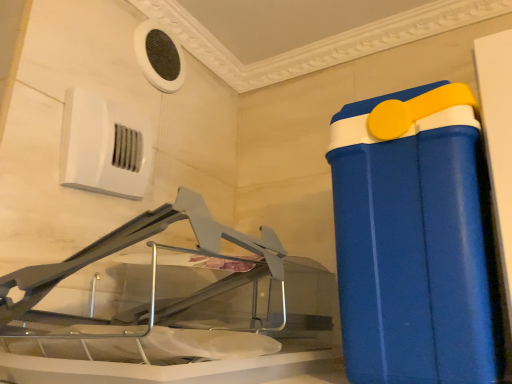
The height and width of the screenshot is (384, 512). What do you see at coordinates (159, 57) in the screenshot?
I see `white mesh air conditioning at upper left, the 2th air conditioning when ordered from front to back` at bounding box center [159, 57].

What do you see at coordinates (105, 146) in the screenshot?
I see `white plastic air conditioning unit at upper left, arranged as the second air conditioning when viewed from the back` at bounding box center [105, 146].

This screenshot has height=384, width=512. Identify the location of white mesh air conditioning at upper left, which is the 1th air conditioning in top-to-bottom order. (159, 57).

Is blue plastic container at right facing away from white plastic air conditioning unit at upper left, the second air conditioning in the top-to-bottom sequence?

No, blue plastic container at right is not facing away from white plastic air conditioning unit at upper left, the second air conditioning in the top-to-bottom sequence.

In the image, is blue plastic container at right on the left side or the right side of white plastic air conditioning unit at upper left, the 1th air conditioning positioned from the bottom?

blue plastic container at right is positioned on white plastic air conditioning unit at upper left, the 1th air conditioning positioned from the bottom,'s right side.

In the scene shown: Is blue plastic container at right not within white plastic air conditioning unit at upper left, arranged as the second air conditioning when viewed from the back?

Yes, blue plastic container at right is not within white plastic air conditioning unit at upper left, arranged as the second air conditioning when viewed from the back.

Considering the points (126, 176) and (159, 35), which point is in front, point (126, 176) or point (159, 35)?

Point (126, 176)

In the scene shown: From a real-world perspective, is white plastic air conditioning unit at upper left, the 1th air conditioning positioned from the bottom, over white mesh air conditioning at upper left, acting as the 2th air conditioning starting from the bottom?

No, from a real-world perspective, white plastic air conditioning unit at upper left, the 1th air conditioning positioned from the bottom, is not over white mesh air conditioning at upper left, acting as the 2th air conditioning starting from the bottom

Consider the image. Who is shorter, white plastic air conditioning unit at upper left, which appears as the 1th air conditioning when viewed from the front, or white mesh air conditioning at upper left, acting as the 2th air conditioning starting from the bottom?

white mesh air conditioning at upper left, acting as the 2th air conditioning starting from the bottom.

Based on the photo, from the image's perspective, does white plastic air conditioning unit at upper left, arranged as the second air conditioning when viewed from the back, appear lower than blue plastic container at right?

Incorrect, from the image's perspective, white plastic air conditioning unit at upper left, arranged as the second air conditioning when viewed from the back, is higher than blue plastic container at right.

Is white plastic air conditioning unit at upper left, the second air conditioning in the top-to-bottom sequence, to the left of blue plastic container at right from the viewer's perspective?

Indeed, white plastic air conditioning unit at upper left, the second air conditioning in the top-to-bottom sequence, is positioned on the left side of blue plastic container at right.

From a real-world perspective, does white plastic air conditioning unit at upper left, arranged as the second air conditioning when viewed from the back, sit lower than blue plastic container at right?

Actually, white plastic air conditioning unit at upper left, arranged as the second air conditioning when viewed from the back, is physically above blue plastic container at right in the real world.

Considering the relative sizes of white plastic air conditioning unit at upper left, the 1th air conditioning positioned from the bottom, and blue plastic container at right in the image provided, is white plastic air conditioning unit at upper left, the 1th air conditioning positioned from the bottom, smaller than blue plastic container at right?

Yes.

Which object is further away from the camera taking this photo, white mesh air conditioning at upper left, acting as the 2th air conditioning starting from the bottom, or white plastic air conditioning unit at upper left, the second air conditioning in the top-to-bottom sequence?

white mesh air conditioning at upper left, acting as the 2th air conditioning starting from the bottom, is behind.

Can you see white mesh air conditioning at upper left, which is the 1th air conditioning in top-to-bottom order, touching white plastic air conditioning unit at upper left, which appears as the 1th air conditioning when viewed from the front?

They are not placed beside each other.

Does point (180, 87) come behind point (85, 120)?

Yes, it is behind point (85, 120).

Considering the positions of objects white mesh air conditioning at upper left, the 2th air conditioning when ordered from front to back, and white plastic air conditioning unit at upper left, the 1th air conditioning positioned from the bottom, in the image provided, who is more to the right, white mesh air conditioning at upper left, the 2th air conditioning when ordered from front to back, or white plastic air conditioning unit at upper left, the 1th air conditioning positioned from the bottom,?

Positioned to the right is white mesh air conditioning at upper left, the 2th air conditioning when ordered from front to back.

Considering the positions of objects white mesh air conditioning at upper left, which is the 1th air conditioning in top-to-bottom order, and blue plastic container at right in the image provided, who is behind, white mesh air conditioning at upper left, which is the 1th air conditioning in top-to-bottom order, or blue plastic container at right?

white mesh air conditioning at upper left, which is the 1th air conditioning in top-to-bottom order, is more distant.

Which is in front, point (138, 51) or point (425, 210)?

The point (425, 210) is closer to the camera.

Does white mesh air conditioning at upper left, placed as the first air conditioning when sorted from back to front, have a lesser height compared to blue plastic container at right?

Yes.

Is blue plastic container at right taller or shorter than white mesh air conditioning at upper left, acting as the 2th air conditioning starting from the bottom?

blue plastic container at right is taller than white mesh air conditioning at upper left, acting as the 2th air conditioning starting from the bottom.

From the image's perspective, is blue plastic container at right beneath white mesh air conditioning at upper left, the 2th air conditioning when ordered from front to back?

Indeed, from the image's perspective, blue plastic container at right is shown beneath white mesh air conditioning at upper left, the 2th air conditioning when ordered from front to back.

Is blue plastic container at right beside white mesh air conditioning at upper left, which is the 1th air conditioning in top-to-bottom order?

blue plastic container at right and white mesh air conditioning at upper left, which is the 1th air conditioning in top-to-bottom order, are not in contact.

Where is `waste container below the white plastic air conditioning unit at upper left, the second air conditioning in the top-to-bottom sequence (from the image's perspective)`? Image resolution: width=512 pixels, height=384 pixels. waste container below the white plastic air conditioning unit at upper left, the second air conditioning in the top-to-bottom sequence (from the image's perspective) is located at coordinates (413, 239).

Image resolution: width=512 pixels, height=384 pixels. I want to click on air conditioning above the white plastic air conditioning unit at upper left, the 1th air conditioning positioned from the bottom (from a real-world perspective), so click(159, 57).

Considering their positions, is blue plastic container at right positioned closer to white plastic air conditioning unit at upper left, which appears as the 1th air conditioning when viewed from the front, than white mesh air conditioning at upper left, which is the 1th air conditioning in top-to-bottom order?

The object closer to white plastic air conditioning unit at upper left, which appears as the 1th air conditioning when viewed from the front, is white mesh air conditioning at upper left, which is the 1th air conditioning in top-to-bottom order.

Estimate the real-world distances between objects in this image. Which object is closer to white mesh air conditioning at upper left, which is the 1th air conditioning in top-to-bottom order, white plastic air conditioning unit at upper left, the second air conditioning in the top-to-bottom sequence, or blue plastic container at right?

white plastic air conditioning unit at upper left, the second air conditioning in the top-to-bottom sequence, lies closer to white mesh air conditioning at upper left, which is the 1th air conditioning in top-to-bottom order, than the other object.

In the scene shown: Estimate the real-world distances between objects in this image. Which object is closer to blue plastic container at right, white mesh air conditioning at upper left, acting as the 2th air conditioning starting from the bottom, or white plastic air conditioning unit at upper left, arranged as the second air conditioning when viewed from the back?

white plastic air conditioning unit at upper left, arranged as the second air conditioning when viewed from the back, is closer to blue plastic container at right.

From the image, which object appears to be farther from white plastic air conditioning unit at upper left, the second air conditioning in the top-to-bottom sequence, white mesh air conditioning at upper left, acting as the 2th air conditioning starting from the bottom, or blue plastic container at right?

blue plastic container at right lies further to white plastic air conditioning unit at upper left, the second air conditioning in the top-to-bottom sequence, than the other object.

Which object lies nearer to the anchor point blue plastic container at right, white plastic air conditioning unit at upper left, the 1th air conditioning positioned from the bottom, or white mesh air conditioning at upper left, placed as the first air conditioning when sorted from back to front?

white plastic air conditioning unit at upper left, the 1th air conditioning positioned from the bottom, lies closer to blue plastic container at right than the other object.

Which object lies further to the anchor point white mesh air conditioning at upper left, the 2th air conditioning when ordered from front to back, blue plastic container at right or white plastic air conditioning unit at upper left, the second air conditioning in the top-to-bottom sequence?

Based on the image, blue plastic container at right appears to be further to white mesh air conditioning at upper left, the 2th air conditioning when ordered from front to back.

You are a GUI agent. You are given a task and a screenshot of the screen. Output one action in this format:
    pyautogui.click(x=<x>, y=<y>)
    Task: Click on the air conditioning between white plastic air conditioning unit at upper left, the second air conditioning in the top-to-bottom sequence, and blue plastic container at right from left to right
    This screenshot has height=384, width=512.
    Given the screenshot: What is the action you would take?
    pyautogui.click(x=159, y=57)